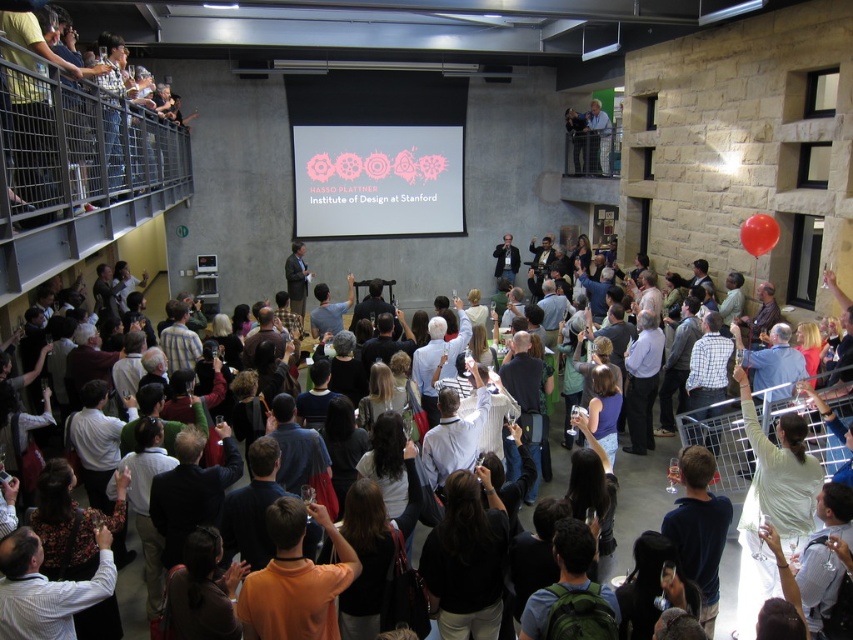
How distant is matte black laptop at center from light blue shirt at upper center?

The distance of matte black laptop at center from light blue shirt at upper center is 9.13 meters.

Can you confirm if matte black laptop at center is taller than light blue shirt at upper center?

Incorrect, matte black laptop at center's height is not larger of light blue shirt at upper center's.

The height and width of the screenshot is (640, 853). Describe the element at coordinates (641, 497) in the screenshot. I see `matte black laptop at center` at that location.

Locate an element on the screen. matte black laptop at center is located at coordinates point(641,497).

Does pink fabric projection screen at center appear under matte black laptop at center?

Incorrect, pink fabric projection screen at center is not positioned below matte black laptop at center.

Who is more distant from viewer, (305, 100) or (140, 604)?

Positioned behind is point (305, 100).

Find the location of a particular element. Image resolution: width=853 pixels, height=640 pixels. pink fabric projection screen at center is located at coordinates (376, 154).

Is pink fabric projection screen at center further to the viewer compared to light blue shirt at upper center?

No, it is in front of light blue shirt at upper center.

Does point (339, 211) come in front of point (601, 124)?

No, (339, 211) is further to viewer.

This screenshot has height=640, width=853. What are the coordinates of `pink fabric projection screen at center` in the screenshot? It's located at (376, 154).